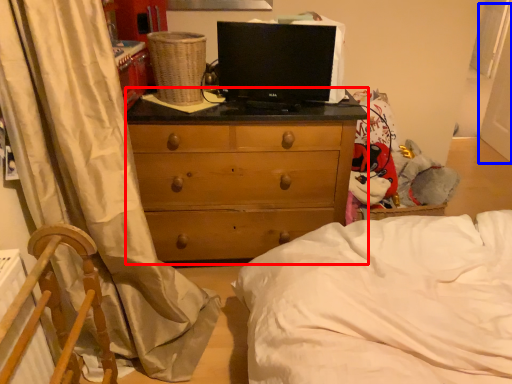
Question: Which object appears closest to the camera in this image, chest of drawers (highlighted by a red box) or screen door (highlighted by a blue box)?

Choices:
 (A) chest of drawers
 (B) screen door

Answer: (A)